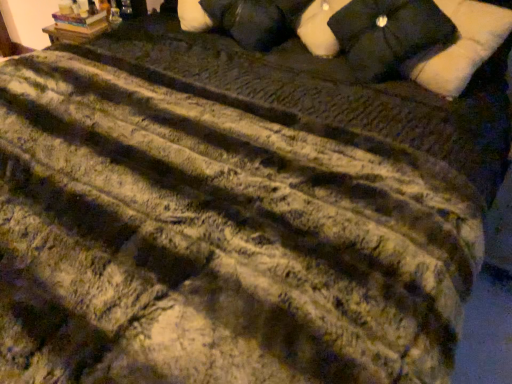
Image resolution: width=512 pixels, height=384 pixels. Describe the element at coordinates (255, 20) in the screenshot. I see `black fuzzy pillow at upper center` at that location.

Based on the photo, in order to face black fuzzy pillow at upper center, should I rotate leftwards or rightwards?

Turn left by 0.388 degrees to look at black fuzzy pillow at upper center.

What is the approximate width of black fuzzy pillow at upper center?

black fuzzy pillow at upper center is 9.98 inches in width.

The image size is (512, 384). Find the location of `black fuzzy pillow at upper center`. black fuzzy pillow at upper center is located at coordinates (255, 20).

Where is `black fuzzy pillow at upper center`? This screenshot has height=384, width=512. black fuzzy pillow at upper center is located at coordinates (255, 20).